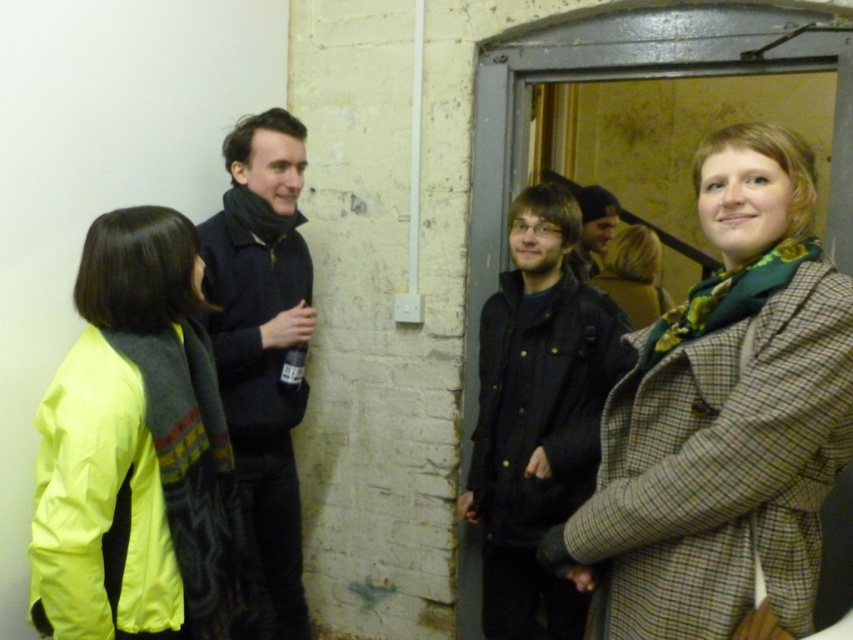
Question: Is green plaid coat at center closer to the viewer compared to dark brown leather jacket at center?

Choices:
 (A) no
 (B) yes

Answer: (B)

Question: Considering the relative positions of green plaid coat at center and dark brown leather jacket at center in the image provided, where is green plaid coat at center located with respect to dark brown leather jacket at center?

Choices:
 (A) above
 (B) below

Answer: (A)

Question: Based on their relative distances, which object is farther from the dark gray jacket at center?

Choices:
 (A) dark brown leather jacket at center
 (B) green plaid coat at center
 (C) green plaid coat at right

Answer: (B)

Question: Is dark blue sweater at center bigger than dark gray jacket at center?

Choices:
 (A) no
 (B) yes

Answer: (B)

Question: Which of the following is the closest to the observer?

Choices:
 (A) dark blue sweater at center
 (B) dark gray jacket at center

Answer: (A)

Question: Which is nearer to the green plaid coat at center?

Choices:
 (A) dark gray jacket at center
 (B) dark brown leather jacket at center
 (C) dark blue sweater at center
 (D) green plaid coat at right

Answer: (B)